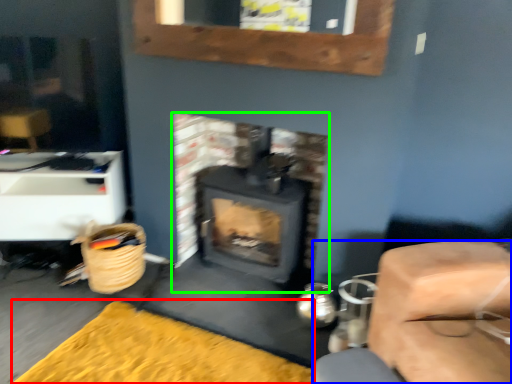
Question: Which is nearer to the doormat (highlighted by a red box)? furniture (highlighted by a blue box) or wood burning stove (highlighted by a green box).

Choices:
 (A) furniture
 (B) wood burning stove

Answer: (A)